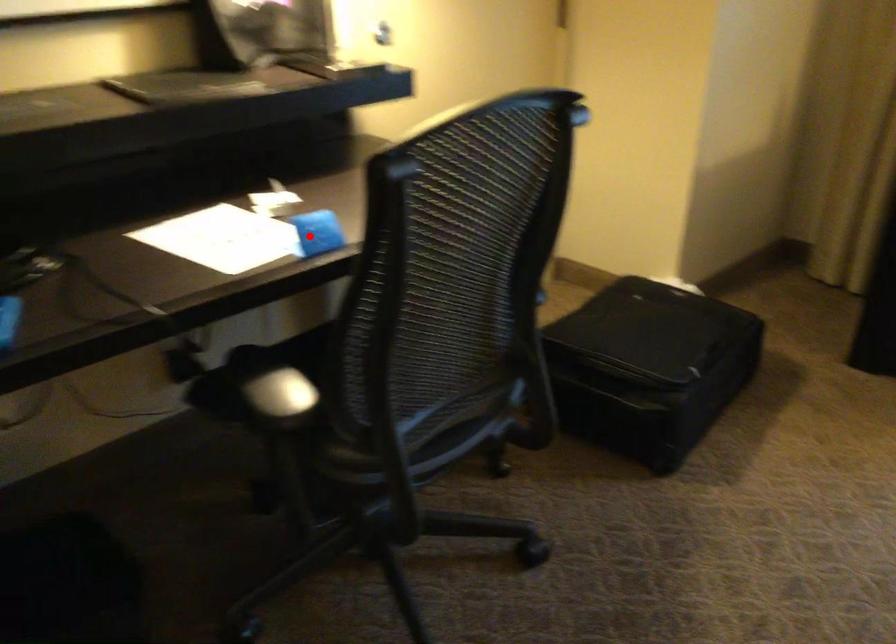
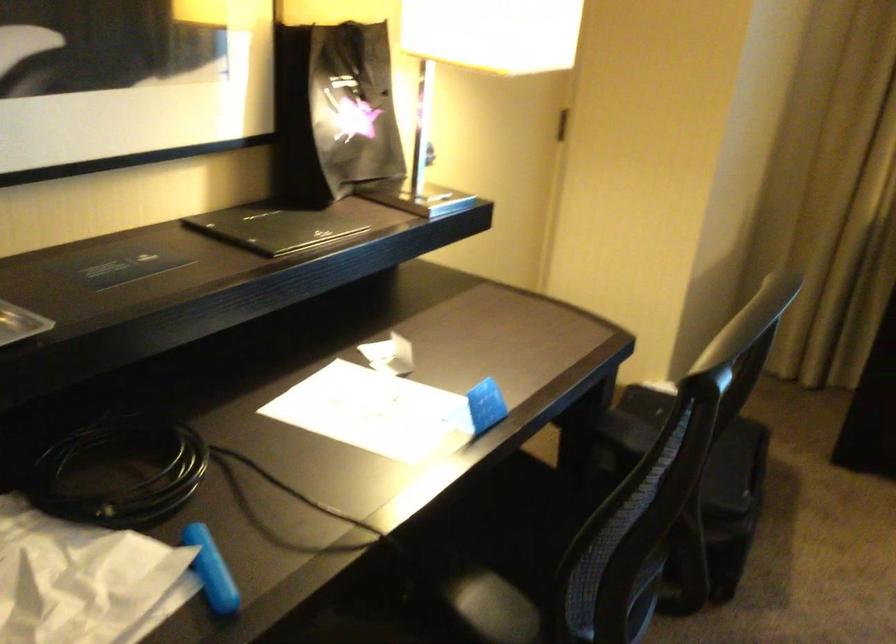
Question: I am providing you with two images of the same scene from different viewpoints. Image1 has a red point marked. In image2, the corresponding 3D location appears at what relative position? Reply with the corresponding letter.

Choices:
 (A) Closer
 (B) Farther

Answer: (A)